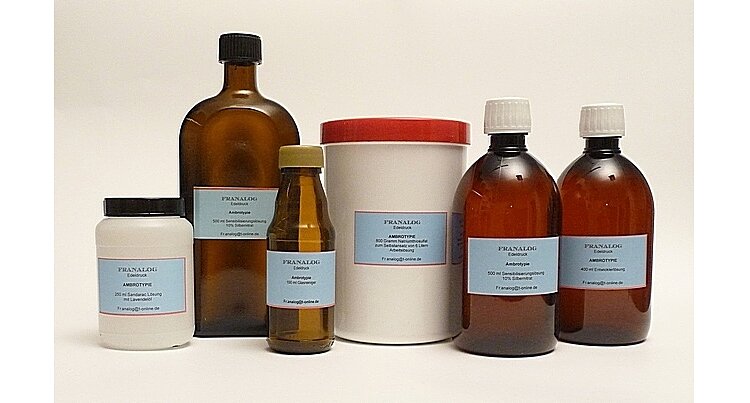
Find the location of a particular element. Image resolution: width=750 pixels, height=403 pixels. picture is located at coordinates (516, 47).